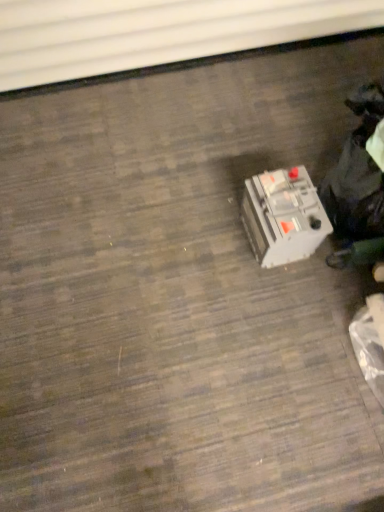
Find the location of `white plastic toy at lower right`. white plastic toy at lower right is located at coordinates (283, 216).

Describe the element at coordinates (283, 216) in the screenshot. I see `white plastic toy at lower right` at that location.

Find the location of a particular element. The width and height of the screenshot is (384, 512). white plastic toy at lower right is located at coordinates (283, 216).